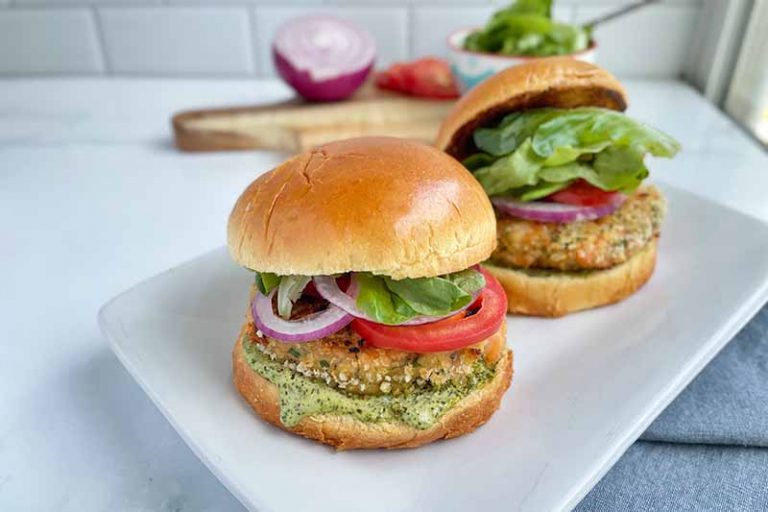
Where is `cutting board`? Image resolution: width=768 pixels, height=512 pixels. cutting board is located at coordinates (637, 368).